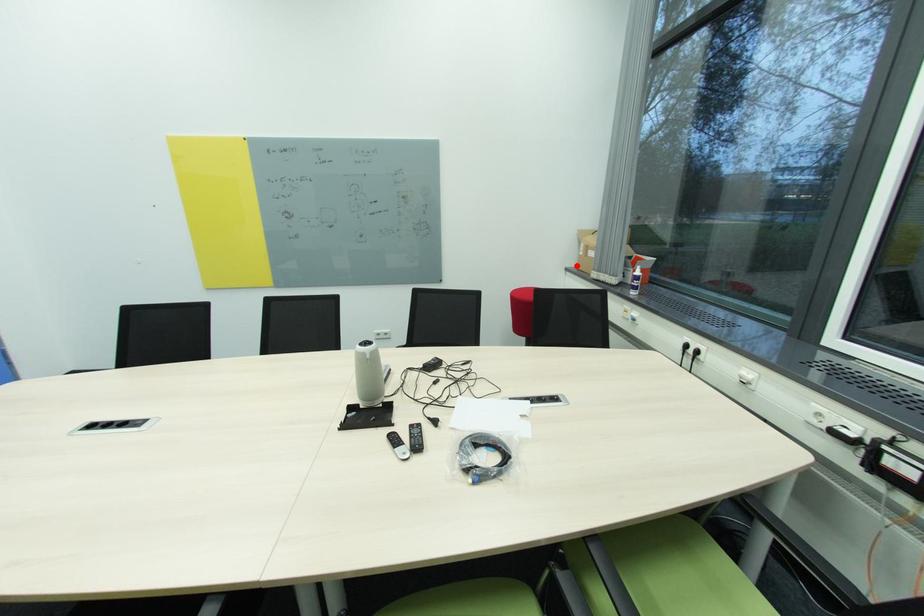
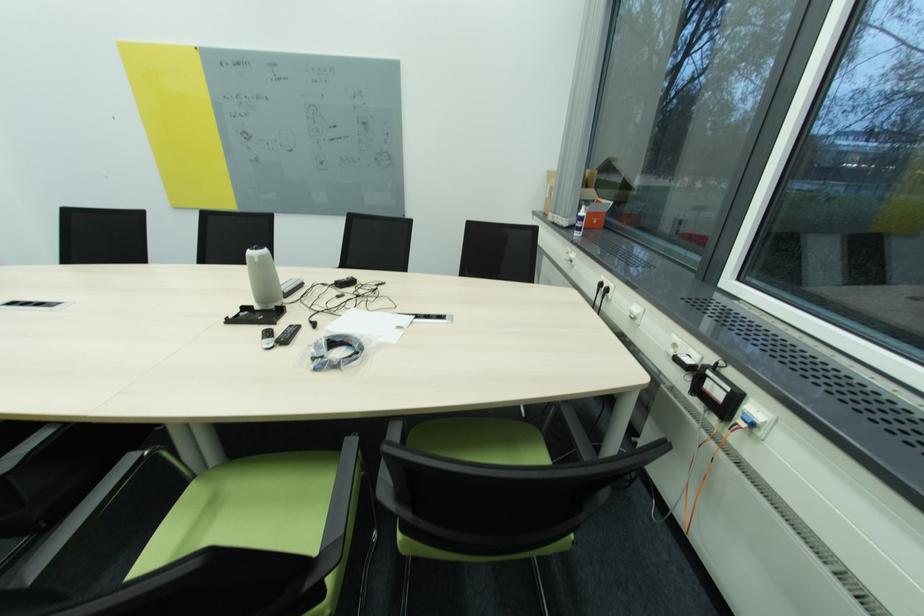
Find the pixel in the second image that matches the highlighted location in the first image.

(544, 209)